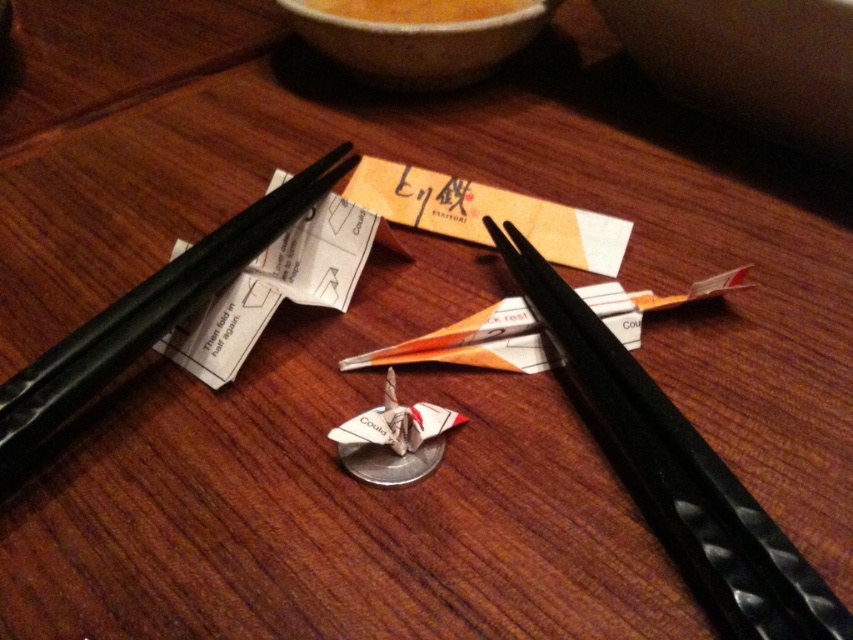
Question: Which point is farther from the camera taking this photo?

Choices:
 (A) [x=827, y=61]
 (B) [x=506, y=252]
 (C) [x=456, y=81]

Answer: (C)

Question: Does black textured chopsticks at left lie behind matte ceramic bowl at upper center?

Choices:
 (A) no
 (B) yes

Answer: (A)

Question: Where is matte ceramic bowl at upper center located in relation to orange matte bowl at upper center in the image?

Choices:
 (A) below
 (B) above

Answer: (A)

Question: Is black textured chopsticks at left in front of matte ceramic bowl at upper center?

Choices:
 (A) no
 (B) yes

Answer: (B)

Question: Among these objects, which one is farthest from the camera?

Choices:
 (A) black textured chopsticks at left
 (B) orange matte bowl at upper center
 (C) matte ceramic bowl at upper center
 (D) matte brown bowl at upper center

Answer: (B)

Question: Considering the real-world distances, which object is closest to the matte ceramic bowl at upper center?

Choices:
 (A) matte brown bowl at upper center
 (B) black textured chopsticks at center

Answer: (A)